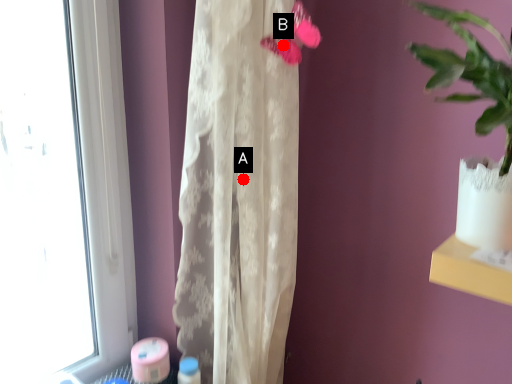
Question: Two points are circled on the image, labeled by A and B beside each circle. Which point appears farthest from the camera in this image?

Choices:
 (A) A is further
 (B) B is further

Answer: (A)